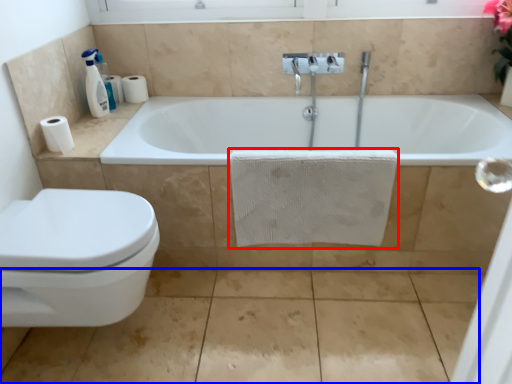
Question: Among these objects, which one is farthest to the camera, bath towel (highlighted by a red box) or concrete (highlighted by a blue box)?

Choices:
 (A) bath towel
 (B) concrete

Answer: (A)